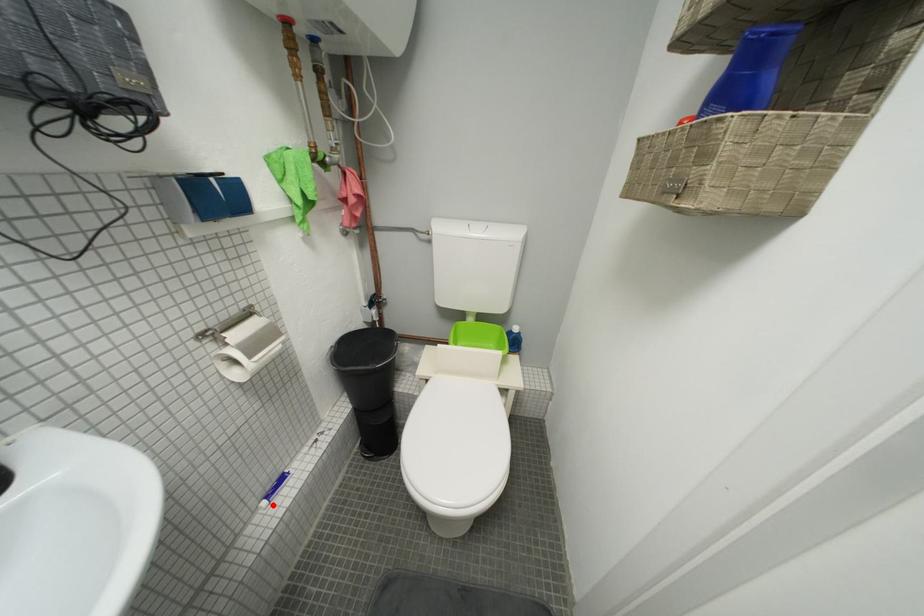
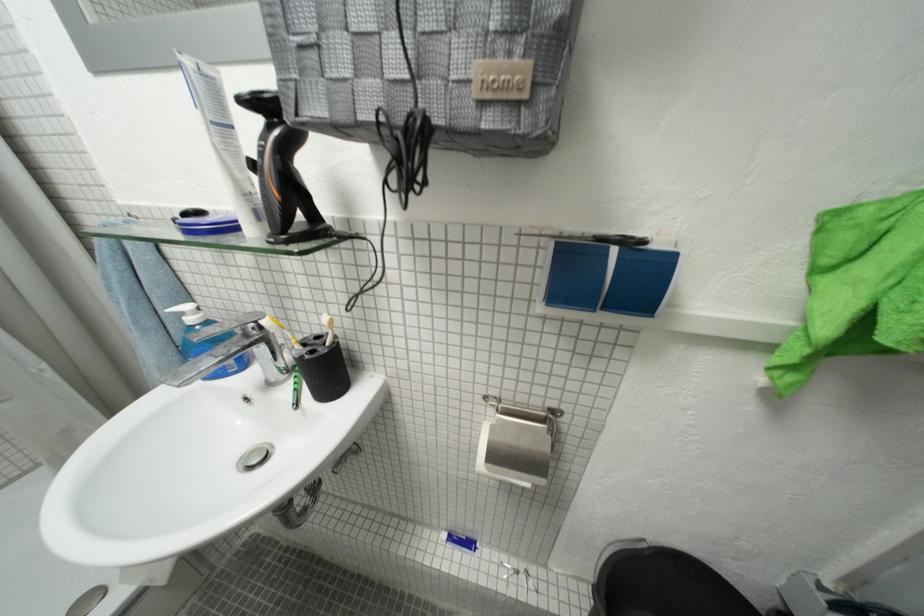
Question: I am providing you with two images of the same scene from different viewpoints. Given a red point in image1, look at the same physical point in image2. Is it:

Choices:
 (A) Closer to the viewpoint
 (B) Farther from the viewpoint

Answer: (B)